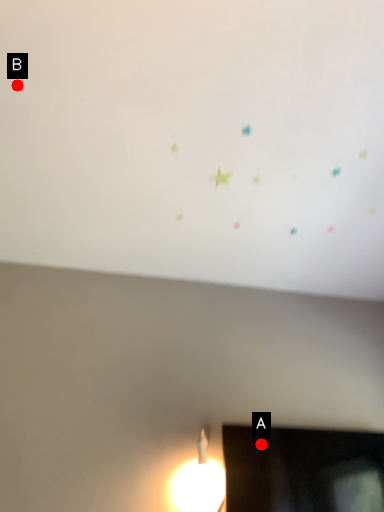
Question: Two points are circled on the image, labeled by A and B beside each circle. Which point is farther from the camera taking this photo?

Choices:
 (A) A is further
 (B) B is further

Answer: (A)